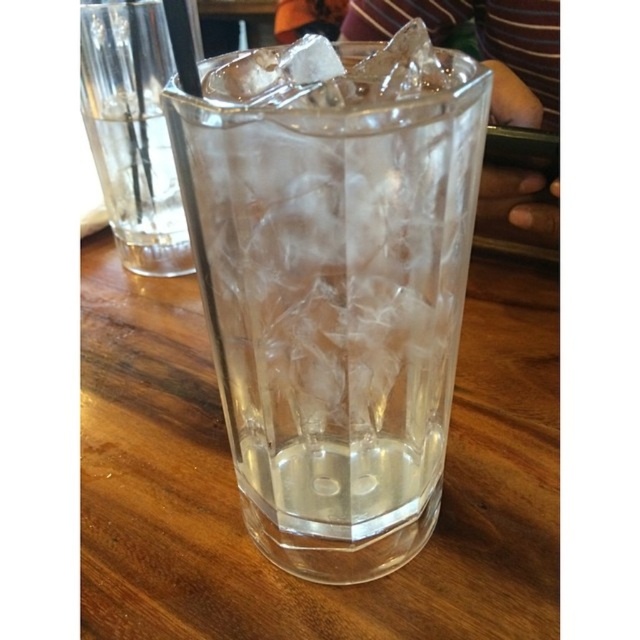
You are holding a small toy drone that is 2 inches in diameter. You want to fly it from your current position to the transparent glass at center in the image. Considering the distance between you and the glass, can the drone safely land on the glass without hitting any obstacles?

The distance between transparent glass at center and the camera is 5.96 inches. Since the drone is 2 inches in diameter, it can safely navigate the 5.96 inches distance to land on the glass without obstacles.

You are a photographer adjusting your camera focus. You need to focus on both the point at point (326, 240) and the point at point (163, 189). Which point should you focus on first to ensure both are in focus?

You should focus on point (326, 240) first because it is closer to the camera than point (163, 189), allowing both points to be in focus when adjusting the depth of field.

You are holding a small toy that is 2 inches wide. You want to place it on the table near the point marked at coordinates point (289,432). Considering the distance between you and the point, will the toy fit without overlapping the glass or the other objects?

The point (289,432) is 8.76 inches away from the viewer. Since the toy is only 2 inches wide, placing it near the point would leave enough space between the toy and the glass or other objects, so it should fit without overlapping.